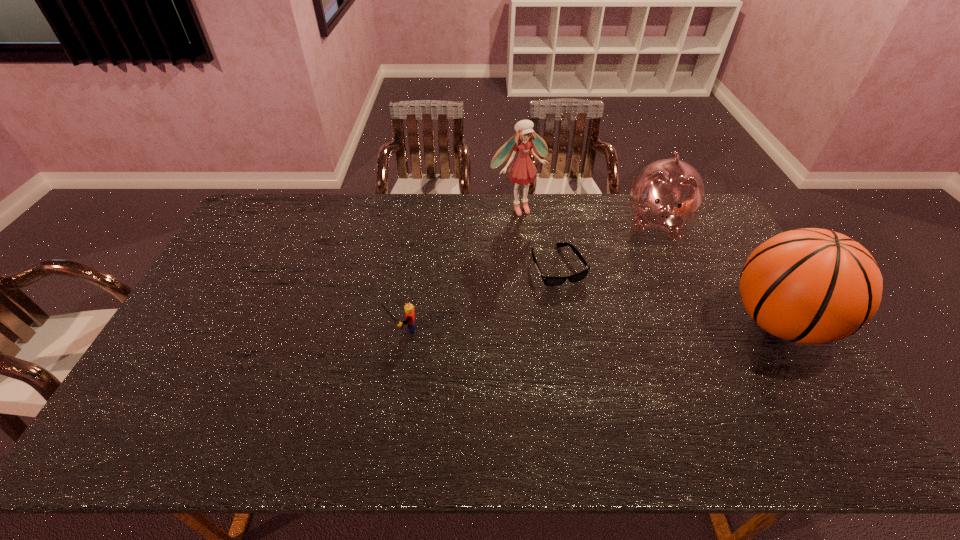
Identify the location of the fourth tallest object. (409, 309).

Identify the location of Lego. The height and width of the screenshot is (540, 960). tap(409, 309).

Where is `basketball`? The image size is (960, 540). basketball is located at coordinates (811, 286).

The height and width of the screenshot is (540, 960). In order to click on the shortest object in this screenshot , I will do `click(548, 280)`.

Identify the location of doll. (522, 171).

The image size is (960, 540). What are the coordinates of `piggy bank` in the screenshot? It's located at [x=668, y=194].

Locate an element on the screen. The image size is (960, 540). vacant area located on the front-facing side of the fourth tallest object is located at coordinates (248, 328).

Identify the location of vacant space located on the front-facing side of the fourth tallest object. Image resolution: width=960 pixels, height=540 pixels. (325, 328).

Locate an element on the screen. The image size is (960, 540). vacant region located on the front-facing side of the fourth tallest object is located at coordinates (304, 328).

This screenshot has height=540, width=960. I want to click on vacant space located on the left of the basketball, so click(688, 323).